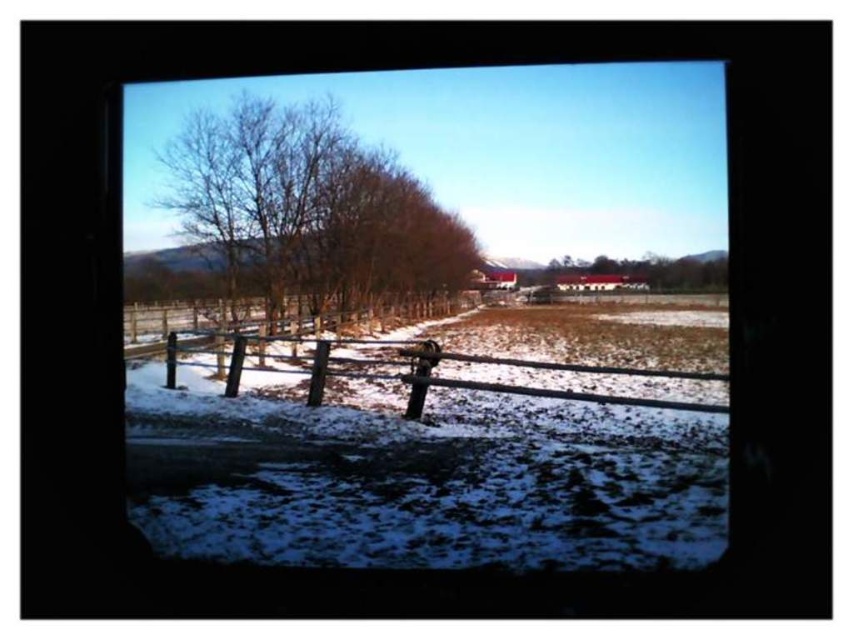
Can you confirm if brown leafless tree at center is positioned below wooden fence at center?

Actually, brown leafless tree at center is above wooden fence at center.

Can you confirm if brown leafless tree at center is positioned to the left of wooden fence at center?

Indeed, brown leafless tree at center is positioned on the left side of wooden fence at center.

Is point (291, 212) positioned after point (294, 362)?

Yes, it is behind point (294, 362).

Image resolution: width=853 pixels, height=640 pixels. Find the location of `brown leafless tree at center`. brown leafless tree at center is located at coordinates pyautogui.click(x=303, y=216).

Does brown leafless tree at center have a greater height compared to brown wood tree at center?

Correct, brown leafless tree at center is much taller as brown wood tree at center.

Is point (303, 193) positioned in front of point (700, 256)?

Yes, it is.

Describe the element at coordinates (303, 216) in the screenshot. I see `brown leafless tree at center` at that location.

This screenshot has height=640, width=853. What are the coordinates of `brown leafless tree at center` in the screenshot? It's located at (303, 216).

How far apart are transparent glass window at center and brown leafless tree at center?

transparent glass window at center is 15.92 feet from brown leafless tree at center.

Which is behind, point (709, 237) or point (373, 292)?

The point (709, 237) is behind.

You are a GUI agent. You are given a task and a screenshot of the screen. Output one action in this format:
    pyautogui.click(x=<x>, y=<y>)
    Task: Click on the transparent glass window at center
    The image size is (853, 640).
    Given the screenshot: What is the action you would take?
    pyautogui.click(x=430, y=314)